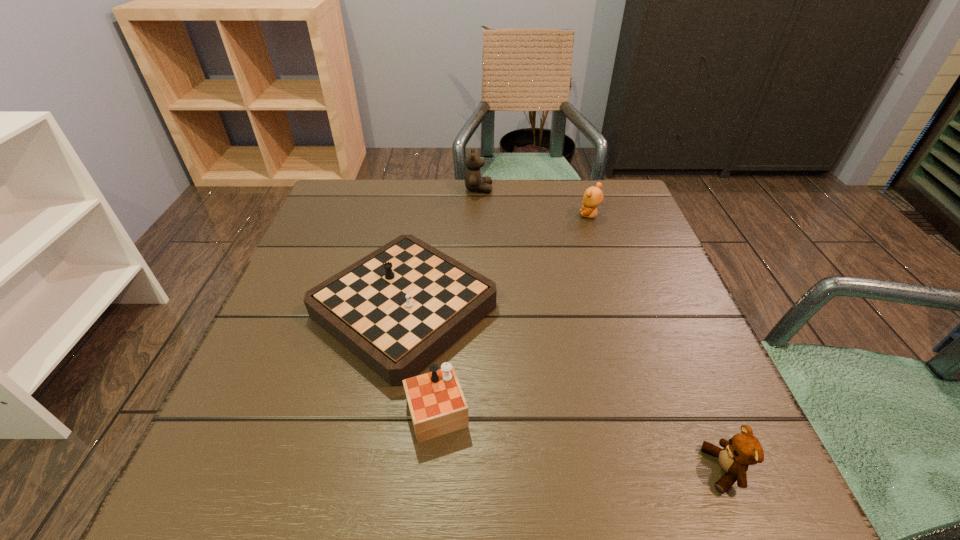
Where is `the tallest teddy bear`? The width and height of the screenshot is (960, 540). the tallest teddy bear is located at coordinates (474, 181).

Identify the location of the leftmost teddy bear. (474, 181).

Find the location of `chessboard`. chessboard is located at coordinates (397, 309).

The image size is (960, 540). Find the location of `the second teddy bear from left to right`. the second teddy bear from left to right is located at coordinates (593, 196).

The height and width of the screenshot is (540, 960). Find the location of `the second object from right to left`. the second object from right to left is located at coordinates pyautogui.click(x=593, y=196).

Where is `the rightmost object`? The width and height of the screenshot is (960, 540). the rightmost object is located at coordinates (743, 449).

Locate an element on the screen. The width and height of the screenshot is (960, 540). the nearest object is located at coordinates (743, 449).

Where is `vacant region located 0.180m on the face of the tallest object`? vacant region located 0.180m on the face of the tallest object is located at coordinates (557, 189).

This screenshot has height=540, width=960. Identify the location of free region located 0.270m on the back of the chessboard. (425, 191).

Locate an element on the screen. The width and height of the screenshot is (960, 540). free spot located 0.120m on the face of the second teddy bear from right to left is located at coordinates (533, 215).